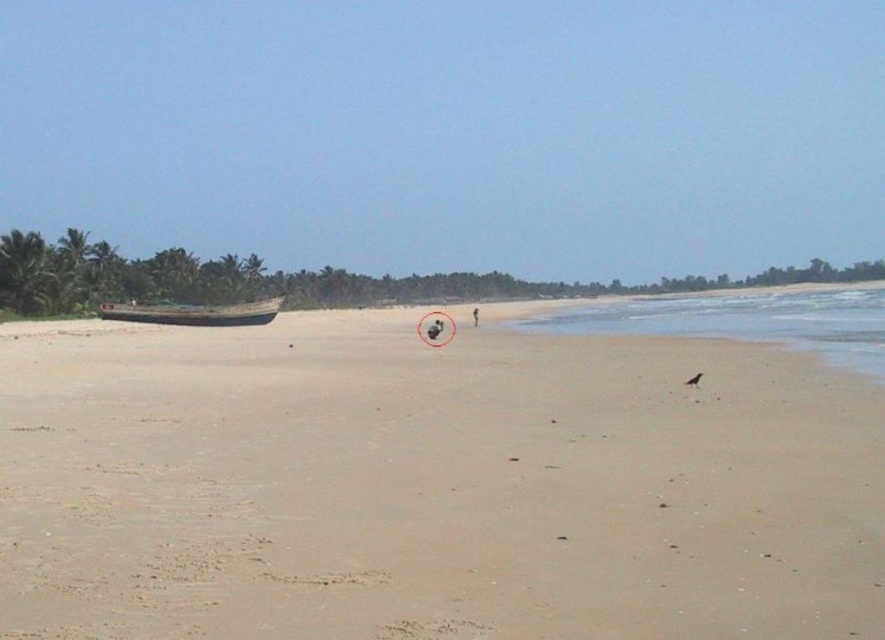
Question: Estimate the real-world distances between objects in this image. Which object is closer to the clear water at beach right?

Choices:
 (A) wooden boat at left
 (B) smooth sand at center

Answer: (B)

Question: Is smooth sand at center to the left of clear water at beach right from the viewer's perspective?

Choices:
 (A) yes
 (B) no

Answer: (A)

Question: Which of the following is the closest to the observer?

Choices:
 (A) smooth sand at center
 (B) clear water at beach right

Answer: (A)

Question: Is clear water at beach right closer to the viewer compared to wooden boat at left?

Choices:
 (A) no
 (B) yes

Answer: (B)

Question: Among these objects, which one is nearest to the camera?

Choices:
 (A) wooden boat at left
 (B) clear water at beach right
 (C) smooth sand at center

Answer: (C)

Question: Is smooth sand at center wider than clear water at beach right?

Choices:
 (A) yes
 (B) no

Answer: (B)